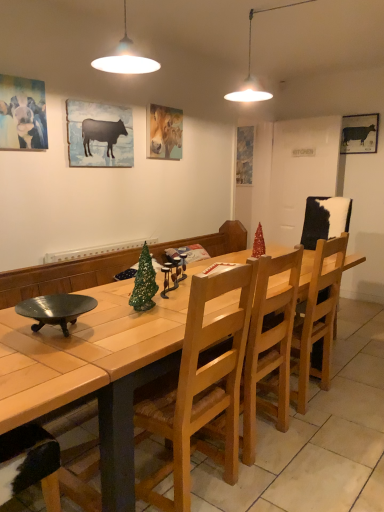
Question: In the image, is matte blue painting at center, positioned as the first picture frame in back-to-front order, on the left side or the right side of wooden chair at center, which is counted as the 2th chair, starting from the front?

Choices:
 (A) left
 (B) right

Answer: (B)

Question: From the image's perspective, is matte blue painting at center, the 2th picture frame when ordered from right to left, above or below wooden chair at center, which is counted as the 2th chair, starting from the front?

Choices:
 (A) below
 (B) above

Answer: (B)

Question: Which of these objects is positioned closest to the light brown wood chair at center, the 2th chair when ordered from right to left?

Choices:
 (A) matte black cow at upper left, positioned as the fifth picture frame in back-to-front order
 (B) cowhide leather chair at right
 (C) pastel oil painting of horse at upper center, acting as the third picture frame starting from the left
 (D) wooden table at center
 (E) silhouette paper cow at upper left, which is counted as the fourth picture frame, starting from the back

Answer: (D)

Question: Which object is positioned farthest from the shiny red christmas tree at center?

Choices:
 (A) pastel oil painting of horse at upper center, the 3th picture frame viewed from the right
 (B) cowhide leather chair at right
 (C) matte blue painting at center, the 2th picture frame when ordered from right to left
 (D) black matte cow at upper right, which is counted as the second picture frame, starting from the back
 (E) silhouette paper cow at upper left, the 4th picture frame in the right-to-left sequence

Answer: (D)